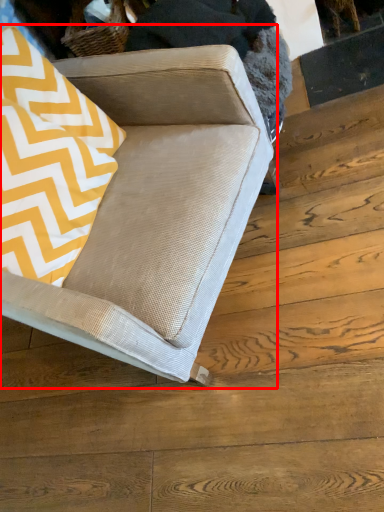
Question: Where is studio couch (annotated by the red box) located in relation to throw pillow in the image?

Choices:
 (A) right
 (B) left

Answer: (A)